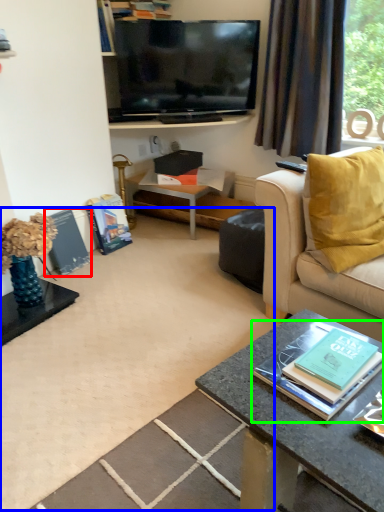
Question: Based on their relative distances, which object is farther from magazine (highlighted by a red box)? Choose from plain (highlighted by a blue box) and book (highlighted by a green box).

Choices:
 (A) plain
 (B) book

Answer: (B)